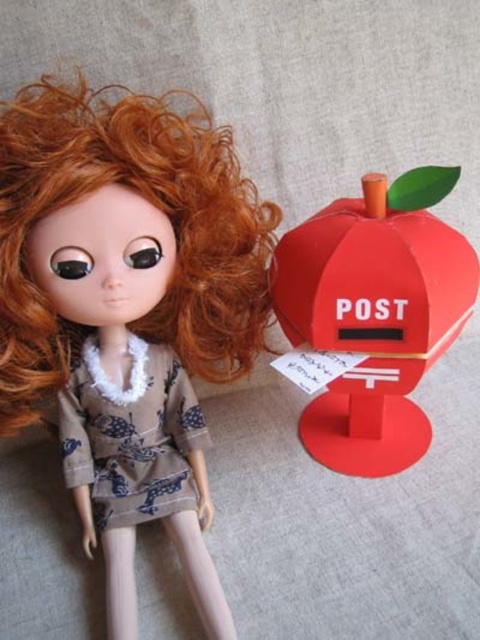
Does matte red mailbox at right appear over printed fabric dress at center?

Yes.

Is point (425, 266) farther from viewer compared to point (144, 358)?

That is False.

Identify the location of matte red mailbox at right. This screenshot has height=640, width=480. (374, 314).

Which is more to the right, matte brown fabric doll at upper left or printed fabric dress at center?

From the viewer's perspective, matte brown fabric doll at upper left appears more on the right side.

Which is behind, point (131, 148) or point (133, 360)?

Positioned behind is point (133, 360).

Find the location of a particular element. matte brown fabric doll at upper left is located at coordinates (128, 310).

Is point (96, 317) closer to camera compared to point (452, 280)?

Yes, it is.

Can you confirm if matte brown fabric doll at upper left is bigger than matte red mailbox at right?

Indeed, matte brown fabric doll at upper left has a larger size compared to matte red mailbox at right.

Does point (144, 124) lie behind point (409, 227)?

No.

At what (x,y) coordinates should I click in order to perform the action: click on matte brown fabric doll at upper left. Please return your answer as a coordinate pair (x, y). The width and height of the screenshot is (480, 640). Looking at the image, I should click on (128, 310).